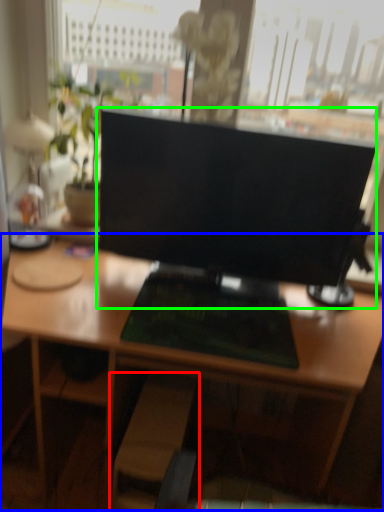
Question: Estimate the real-world distances between objects in this image. Which object is closer to swivel chair (highlighted by a red box), desk (highlighted by a blue box) or computer monitor (highlighted by a green box)?

Choices:
 (A) desk
 (B) computer monitor

Answer: (A)